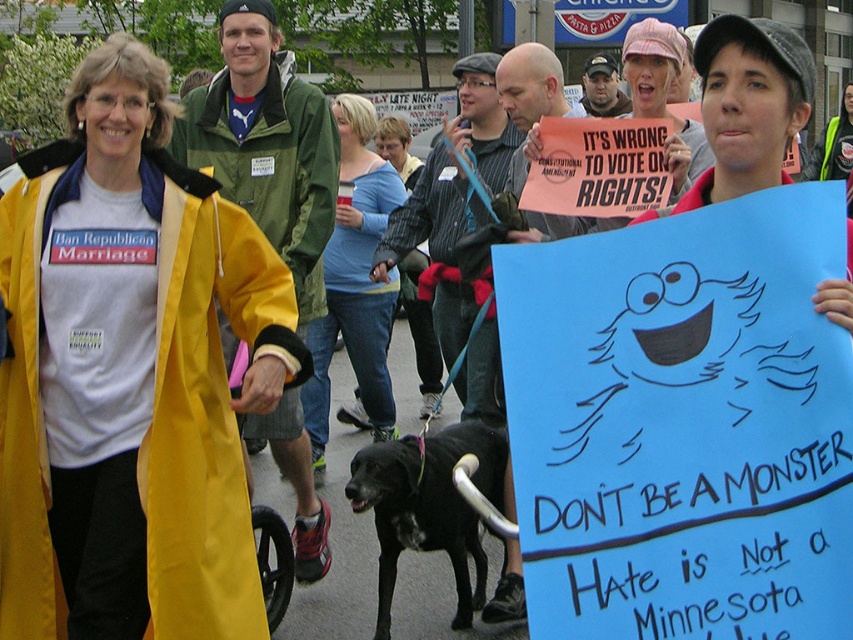
Can you confirm if yellow matte raincoat at left is bigger than black fur dog at center?

Correct, yellow matte raincoat at left is larger in size than black fur dog at center.

Which is above, yellow matte raincoat at left or black fur dog at center?

yellow matte raincoat at left

Who is more distant from viewer, (171,384) or (350,470)?

Positioned behind is point (350,470).

Where is `yellow matte raincoat at left`? Image resolution: width=853 pixels, height=640 pixels. yellow matte raincoat at left is located at coordinates (131, 376).

Which of these two, blue cotton shirt at center or black fur dog at center, stands shorter?

With less height is black fur dog at center.

Which is above, blue cotton shirt at center or black fur dog at center?

Positioned higher is blue cotton shirt at center.

I want to click on blue cotton shirt at center, so click(x=355, y=282).

Who is lower down, yellow matte raincoat at left or blue cotton shirt at center?

yellow matte raincoat at left

Between point (125, 282) and point (328, 353), which one is positioned in front?

Positioned in front is point (125, 282).

What do you see at coordinates (131, 376) in the screenshot? This screenshot has height=640, width=853. I see `yellow matte raincoat at left` at bounding box center [131, 376].

At what (x,y) coordinates should I click in order to perform the action: click on yellow matte raincoat at left. Please return your answer as a coordinate pair (x, y). This screenshot has width=853, height=640. Looking at the image, I should click on (131, 376).